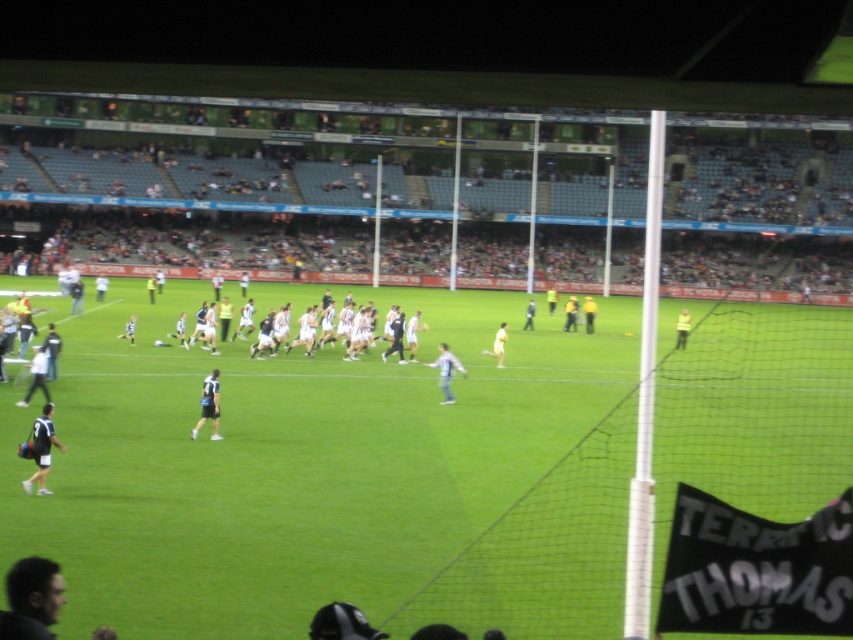
You are a photographer at the stadium. You want to take a photo of the dark brown hair at lower left. Where exactly should you point your camera?

You should point your camera at point (32, 600) to capture the dark brown hair at lower left.

You are a photographer at the stadium. You want to capture a photo that includes both the dark brown hair at lower left and the white jersey at center. Which object should you focus on first to ensure both are in frame?

The dark brown hair at lower left is shorter than the white jersey at center. To include both in the frame, focus on the white jersey at center first, then adjust to include the shorter dark brown hair at lower left.

Consider the image. You are a photographer standing at the edge of the rugby field. You want to take a photo that includes both the dark brown hair at lower left and the white fabric shirt at center. Which object should you focus on first if you want to ensure both are in the frame?

The dark brown hair at lower left is shorter than the white fabric shirt at center, so you should focus on the white fabric shirt at center first to ensure both are in the frame.